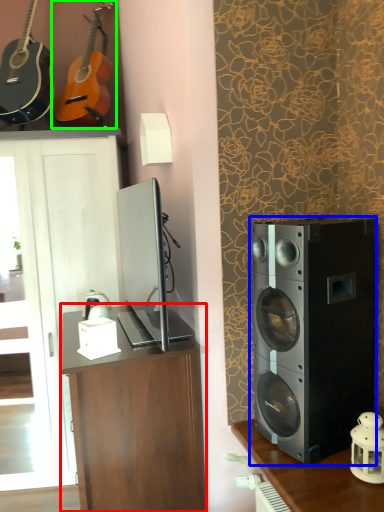
Question: Considering the real-world distances, which object is farthest from desk (highlighted by a red box)? loudspeaker (highlighted by a blue box) or guitar (highlighted by a green box)?

Choices:
 (A) loudspeaker
 (B) guitar

Answer: (B)